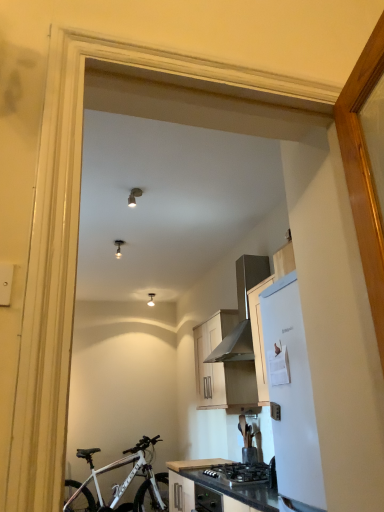
Question: Is matte wood cabinet at center closer to camera compared to black granite countertop at lower center?

Choices:
 (A) no
 (B) yes

Answer: (A)

Question: From the image's perspective, is matte wood cabinet at center on black granite countertop at lower center?

Choices:
 (A) yes
 (B) no

Answer: (A)

Question: Are matte wood cabinet at center and black granite countertop at lower center located far from each other?

Choices:
 (A) no
 (B) yes

Answer: (A)

Question: Is matte wood cabinet at center bigger than black granite countertop at lower center?

Choices:
 (A) yes
 (B) no

Answer: (A)

Question: Can you confirm if matte wood cabinet at center is thinner than black granite countertop at lower center?

Choices:
 (A) yes
 (B) no

Answer: (A)

Question: Can you see matte wood cabinet at center touching black granite countertop at lower center?

Choices:
 (A) no
 (B) yes

Answer: (A)

Question: Is black granite countertop at lower center oriented towards metallic silver range hood at upper right?

Choices:
 (A) no
 (B) yes

Answer: (A)

Question: From the image's perspective, is black granite countertop at lower center below metallic silver range hood at upper right?

Choices:
 (A) no
 (B) yes

Answer: (B)

Question: Is black granite countertop at lower center wider than metallic silver range hood at upper right?

Choices:
 (A) yes
 (B) no

Answer: (A)

Question: Can you confirm if black granite countertop at lower center is bigger than metallic silver range hood at upper right?

Choices:
 (A) yes
 (B) no

Answer: (B)

Question: Is the depth of black granite countertop at lower center less than that of metallic silver range hood at upper right?

Choices:
 (A) no
 (B) yes

Answer: (A)

Question: Is black granite countertop at lower center smaller than metallic silver range hood at upper right?

Choices:
 (A) yes
 (B) no

Answer: (A)

Question: Does metallic silver range hood at upper right come behind black granite countertop at lower center?

Choices:
 (A) no
 (B) yes

Answer: (A)